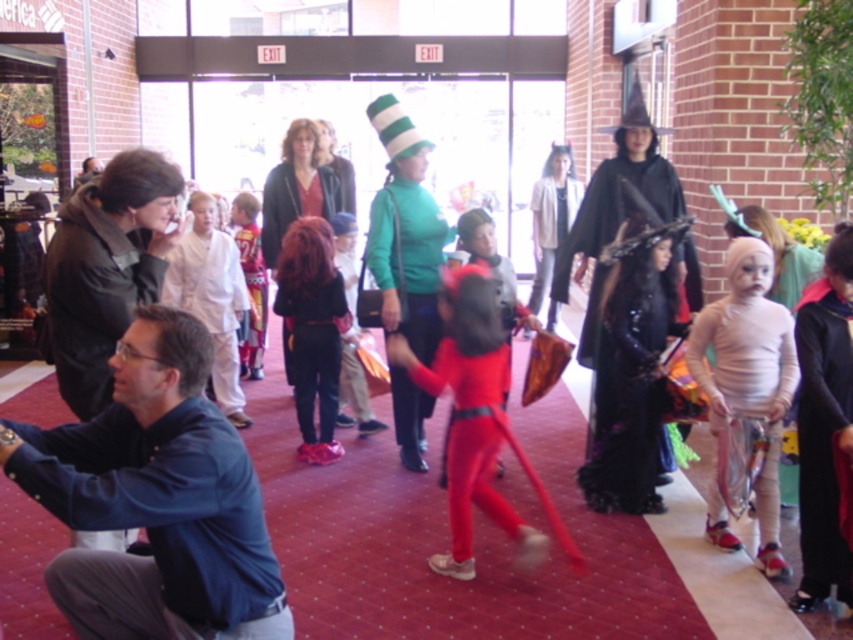
Question: Estimate the real-world distances between objects in this image. Which object is closer to the black velvet cape at center?

Choices:
 (A) blue shirt at lower left
 (B) matte white shirt at center
 (C) blue fabric shirt at lower left

Answer: (A)

Question: Which is farther from the blue shirt at lower left?

Choices:
 (A) blue fabric shirt at lower left
 (B) matte white shirt at center

Answer: (B)

Question: Which of the following is the farthest from the observer?

Choices:
 (A) green matte sweater at center
 (B) blue fabric shirt at lower left

Answer: (A)

Question: Where is blue shirt at lower left located in relation to blue fabric shirt at lower left in the image?

Choices:
 (A) right
 (B) left

Answer: (A)

Question: Can you confirm if blue fabric shirt at lower left is wider than green matte sweater at center?

Choices:
 (A) no
 (B) yes

Answer: (B)

Question: Is blue shirt at lower left to the left of black velvet cape at center from the viewer's perspective?

Choices:
 (A) yes
 (B) no

Answer: (A)